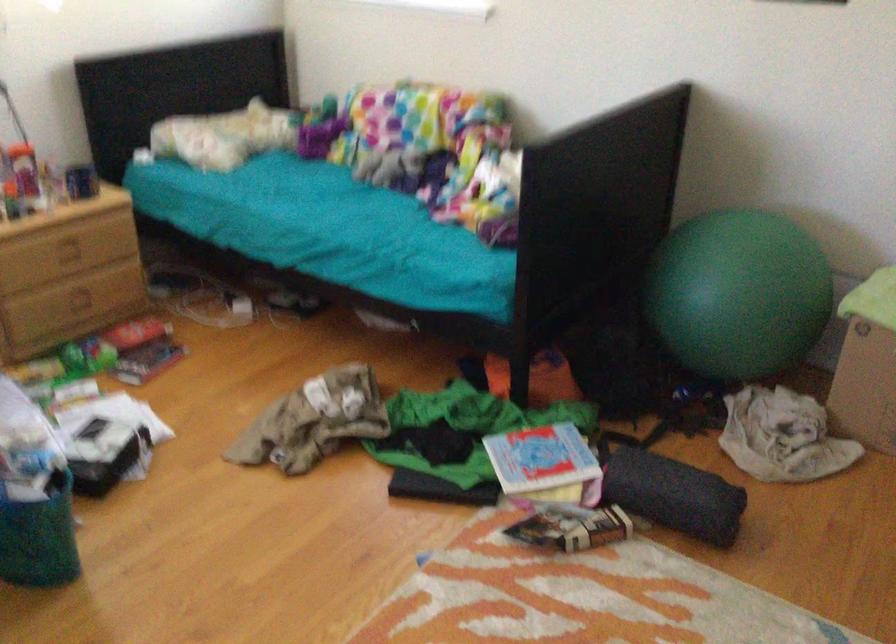
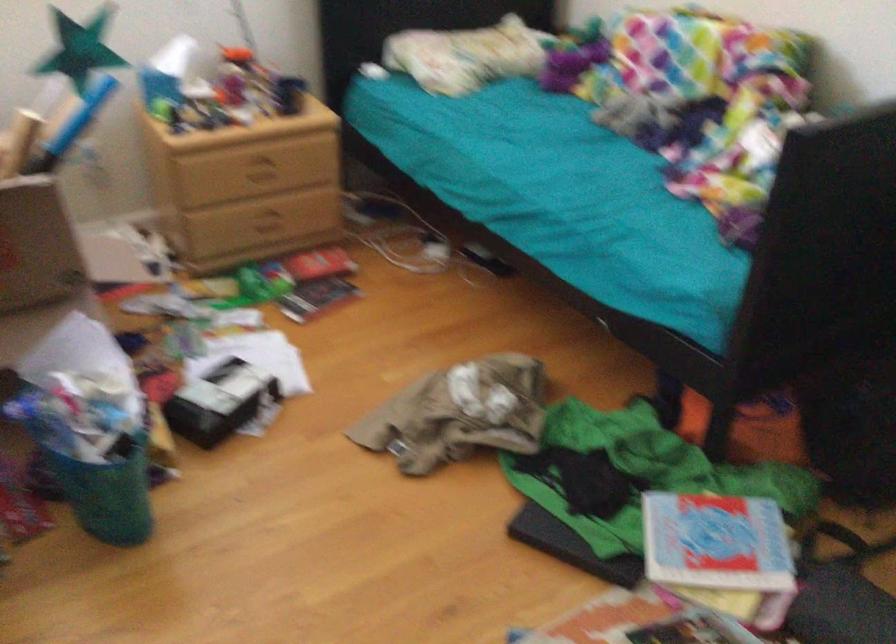
In the second image, find the point that corresponds to [82,249] in the first image.

(266, 172)